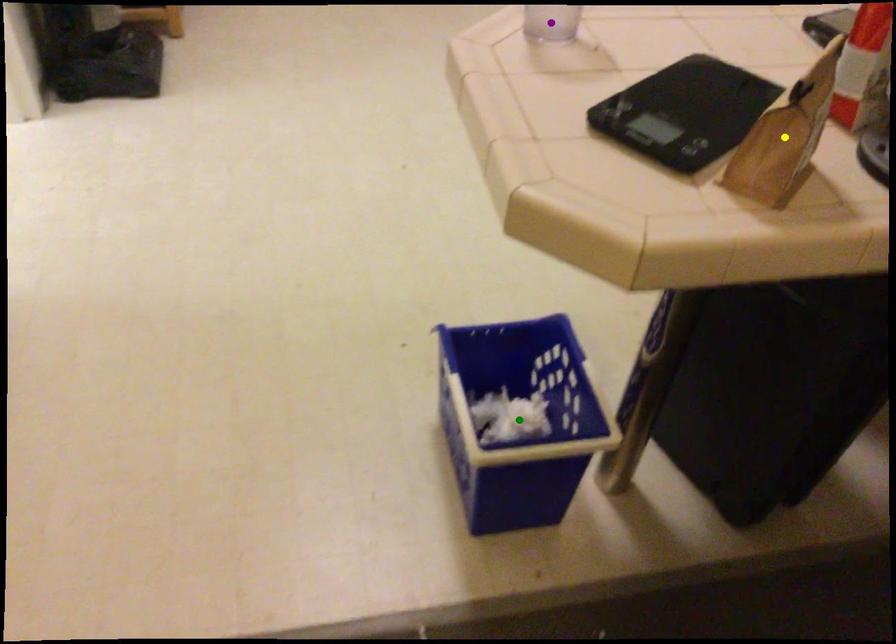
Based on the photo, order these from nearest to farthest:
A) purple point
B) yellow point
C) green point

yellow point → purple point → green point